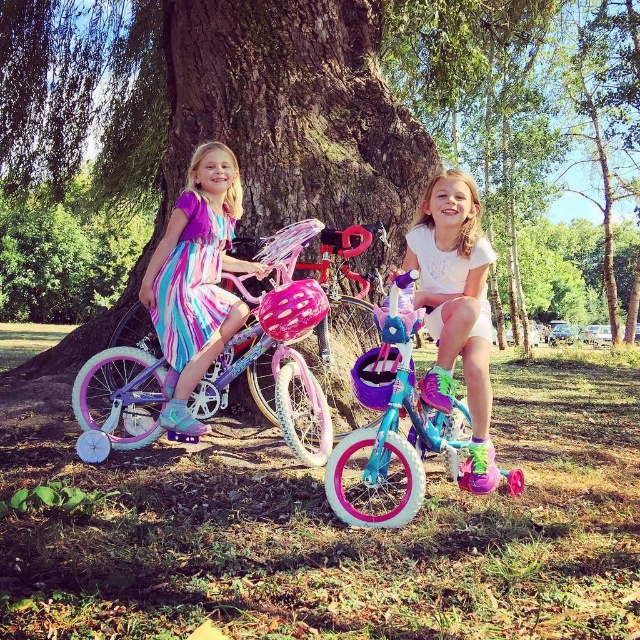
Which is more to the right, multicolored silky dress at center or pink matte bicycle helmet at center?

pink matte bicycle helmet at center is more to the right.

Is multicolored silky dress at center positioned at the back of pink matte bicycle helmet at center?

Yes, it is behind pink matte bicycle helmet at center.

Where is `multicolored silky dress at center`? This screenshot has width=640, height=640. multicolored silky dress at center is located at coordinates (193, 282).

Does pink glossy bicycle at left appear over purple matte bicycle helmet at center?

Correct, pink glossy bicycle at left is located above purple matte bicycle helmet at center.

You are a GUI agent. You are given a task and a screenshot of the screen. Output one action in this format:
    pyautogui.click(x=<x>, y=<y>)
    Task: Click on the pink glossy bicycle at left
    This screenshot has height=640, width=640.
    Given the screenshot: What is the action you would take?
    pyautogui.click(x=276, y=340)

Is pink glossy bicycle at left taller than matte purple dress at left?

Incorrect, pink glossy bicycle at left's height is not larger of matte purple dress at left's.

Is point (317, 292) positioned before point (195, 164)?

Yes.

At what (x,y) coordinates should I click in order to perform the action: click on pink glossy bicycle at left. Please return your answer as a coordinate pair (x, y). This screenshot has width=640, height=640. Looking at the image, I should click on (276, 340).